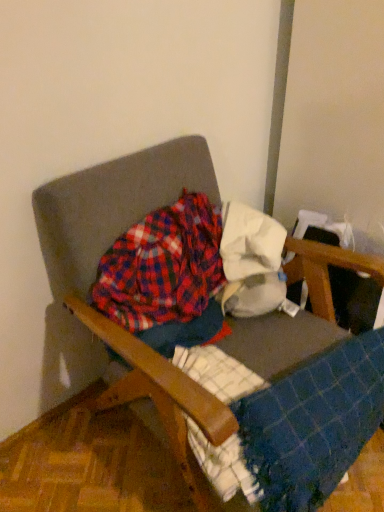
This screenshot has height=512, width=384. What are the coordinates of `plaid fabric at center` in the screenshot? It's located at pos(162,266).

What do you see at coordinates (313, 423) in the screenshot? The image size is (384, 512). I see `blue checkered blanket at lower right` at bounding box center [313, 423].

Where is `blue checkered blanket at lower right`? This screenshot has width=384, height=512. blue checkered blanket at lower right is located at coordinates (313, 423).

What is the approximate width of white cotton cloth at upper right?

It is 13.36 inches.

You are a GUI agent. You are given a task and a screenshot of the screen. Output one action in this format:
    pyautogui.click(x=<x>, y=<y>)
    Task: Click on the plaid fabric at center
    
    Given the screenshot: What is the action you would take?
    pyautogui.click(x=162, y=266)

Is blue checkered blanket at lower right smaller than wooden armchair at center?

Yes, blue checkered blanket at lower right is smaller than wooden armchair at center.

Looking at this image, in terms of height, does blue checkered blanket at lower right look taller or shorter compared to wooden armchair at center?

In the image, blue checkered blanket at lower right appears to be shorter than wooden armchair at center.

At what (x,y) coordinates should I click in order to perform the action: click on chair lying on the left of blue checkered blanket at lower right. Please return your answer as a coordinate pair (x, y). Looking at the image, I should click on pyautogui.click(x=111, y=205).

Does blue checkered blanket at lower right appear on the right side of wooden armchair at center?

Indeed, blue checkered blanket at lower right is positioned on the right side of wooden armchair at center.

Is blue checkered blanket at lower right placed right next to plaid fabric at center?

blue checkered blanket at lower right and plaid fabric at center are not in contact.

Does blue checkered blanket at lower right come in front of plaid fabric at center?

Yes, blue checkered blanket at lower right is closer to the viewer.

How much distance is there between blue checkered blanket at lower right and plaid fabric at center?

A distance of 15.53 inches exists between blue checkered blanket at lower right and plaid fabric at center.

Can you confirm if blue checkered blanket at lower right is shorter than plaid fabric at center?

Incorrect, the height of blue checkered blanket at lower right does not fall short of that of plaid fabric at center.

Is white cotton cloth at upper right positioned in front of wooden armchair at center?

No, white cotton cloth at upper right is behind wooden armchair at center.

From the image's perspective, which one is positioned higher, white cotton cloth at upper right or wooden armchair at center?

white cotton cloth at upper right, from the image's perspective.

Is white cotton cloth at upper right outside of wooden armchair at center?

Actually, white cotton cloth at upper right is at least partially inside wooden armchair at center.

How different are the orientations of white cotton cloth at upper right and wooden armchair at center in degrees?

The angular difference between white cotton cloth at upper right and wooden armchair at center is 48.2 degrees.

You are a GUI agent. You are given a task and a screenshot of the screen. Output one action in this format:
    pyautogui.click(x=<x>, y=<y>)
    Task: Click on the flannel behind the wooden armchair at center
    This screenshot has height=512, width=384.
    Given the screenshot: What is the action you would take?
    pyautogui.click(x=162, y=266)

Consider the image. Is wooden armchair at center outside of plaid fabric at center?

wooden armchair at center lies outside plaid fabric at center's area.

Is wooden armchair at center touching plaid fabric at center?

No, wooden armchair at center is not in contact with plaid fabric at center.

Which is more distant, (157, 195) or (218, 237)?

The point (218, 237) is more distant.

From a real-world perspective, is white cotton cloth at upper right on top of plaid fabric at center?

Yes, from a real-world perspective, white cotton cloth at upper right is on top of plaid fabric at center.

Which object is further away from the camera taking this photo, white cotton cloth at upper right or plaid fabric at center?

white cotton cloth at upper right is further away from the camera.

In terms of width, does white cotton cloth at upper right look wider or thinner when compared to plaid fabric at center?

Clearly, white cotton cloth at upper right has more width compared to plaid fabric at center.

Which is correct: white cotton cloth at upper right is inside plaid fabric at center, or outside of it?

white cotton cloth at upper right is not inside plaid fabric at center, it's outside.

Who is smaller, plaid fabric at center or white cotton cloth at upper right?

Smaller between the two is white cotton cloth at upper right.

From the image's perspective, does plaid fabric at center appear lower than white cotton cloth at upper right?

Yes.

Is plaid fabric at center facing away from white cotton cloth at upper right?

plaid fabric at center is not turned away from white cotton cloth at upper right.

Between plaid fabric at center and white cotton cloth at upper right, which one has less height?

white cotton cloth at upper right.

Locate an element on the screen. The image size is (384, 512). flannel on the left of wooden armchair at center is located at coordinates (162, 266).

Is plaid fabric at center facing towards wooden armchair at center?

Yes, plaid fabric at center faces towards wooden armchair at center.

Would you say plaid fabric at center is to the left or to the right of wooden armchair at center in the picture?

From the image, it's evident that plaid fabric at center is to the left of wooden armchair at center.

From a real-world perspective, who is located lower, plaid fabric at center or wooden armchair at center?

wooden armchair at center.

In the image, there is a blue checkered blanket at lower right. Where is `chair above it (from the image's perspective)`? The width and height of the screenshot is (384, 512). chair above it (from the image's perspective) is located at coordinates (111, 205).

Find the location of a particular element. The width and height of the screenshot is (384, 512). blanket below the plaid fabric at center (from the image's perspective) is located at coordinates (313, 423).

Consider the image. When comparing their distances from plaid fabric at center, does white cotton cloth at upper right or wooden armchair at center seem further?

white cotton cloth at upper right lies further to plaid fabric at center than the other object.

Looking at the image, which one is located closer to white cotton cloth at upper right, wooden armchair at center or blue checkered blanket at lower right?

wooden armchair at center is closer to white cotton cloth at upper right.

Estimate the real-world distances between objects in this image. Which object is further from wooden armchair at center, blue checkered blanket at lower right or white cotton cloth at upper right?

The object further to wooden armchair at center is blue checkered blanket at lower right.

When comparing their distances from wooden armchair at center, does plaid fabric at center or blue checkered blanket at lower right seem further?

The object further to wooden armchair at center is blue checkered blanket at lower right.

When comparing their distances from white cotton cloth at upper right, does plaid fabric at center or blue checkered blanket at lower right seem further?

blue checkered blanket at lower right.

Looking at the image, which one is located further to white cotton cloth at upper right, plaid fabric at center or wooden armchair at center?

Among the two, wooden armchair at center is located further to white cotton cloth at upper right.

Based on their spatial positions, is blue checkered blanket at lower right or white cotton cloth at upper right further from plaid fabric at center?

Based on the image, blue checkered blanket at lower right appears to be further to plaid fabric at center.

When comparing their distances from wooden armchair at center, does blue checkered blanket at lower right or plaid fabric at center seem further?

Among the two, blue checkered blanket at lower right is located further to wooden armchair at center.

Where is `blanket between wooden armchair at center and white cotton cloth at upper right from front to back`? Image resolution: width=384 pixels, height=512 pixels. blanket between wooden armchair at center and white cotton cloth at upper right from front to back is located at coordinates (313, 423).

Where is `flannel between white cotton cloth at upper right and blue checkered blanket at lower right from top to bottom`? flannel between white cotton cloth at upper right and blue checkered blanket at lower right from top to bottom is located at coordinates (162, 266).

Image resolution: width=384 pixels, height=512 pixels. Identify the location of chair between plaid fabric at center and blue checkered blanket at lower right in the horizontal direction. (111, 205).

The height and width of the screenshot is (512, 384). What are the coordinates of `flannel between wooden armchair at center and white cotton cloth at upper right from front to back` in the screenshot? It's located at (162, 266).